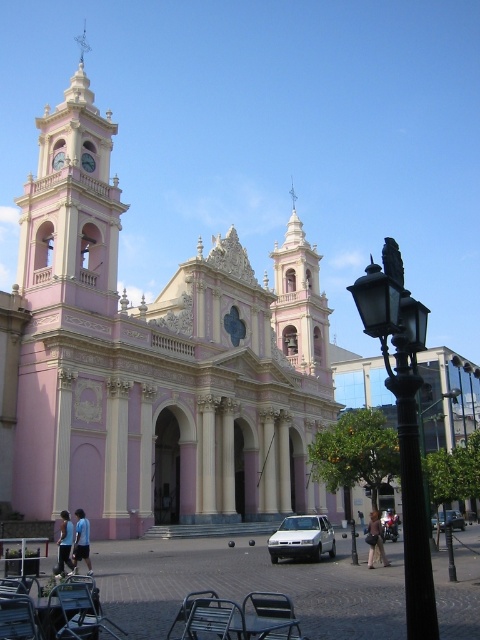
Question: Which object is positioned farthest from the pink matte church at center?

Choices:
 (A) silver metallic sedan at center
 (B) blue fabric shirt at lower left
 (C) light brown leather jacket at lower center

Answer: (C)

Question: Does black metal streetlight at lower right come behind silver metallic sedan at center?

Choices:
 (A) no
 (B) yes

Answer: (A)

Question: Is pink matte church at center wider than white matte car at lower center?

Choices:
 (A) yes
 (B) no

Answer: (A)

Question: Estimate the real-world distances between objects in this image. Which object is closer to the light brown leather jacket at lower center?

Choices:
 (A) white matte car at lower center
 (B) black metal streetlight at lower right
 (C) silver metallic sedan at center

Answer: (A)

Question: Is black metal streetlight at lower right to the right of light blue fabric pants at lower left from the viewer's perspective?

Choices:
 (A) yes
 (B) no

Answer: (A)

Question: Which of the following is the closest to the observer?

Choices:
 (A) (400, 392)
 (B) (315, 554)
 (C) (88, 547)
 (D) (372, 556)

Answer: (A)